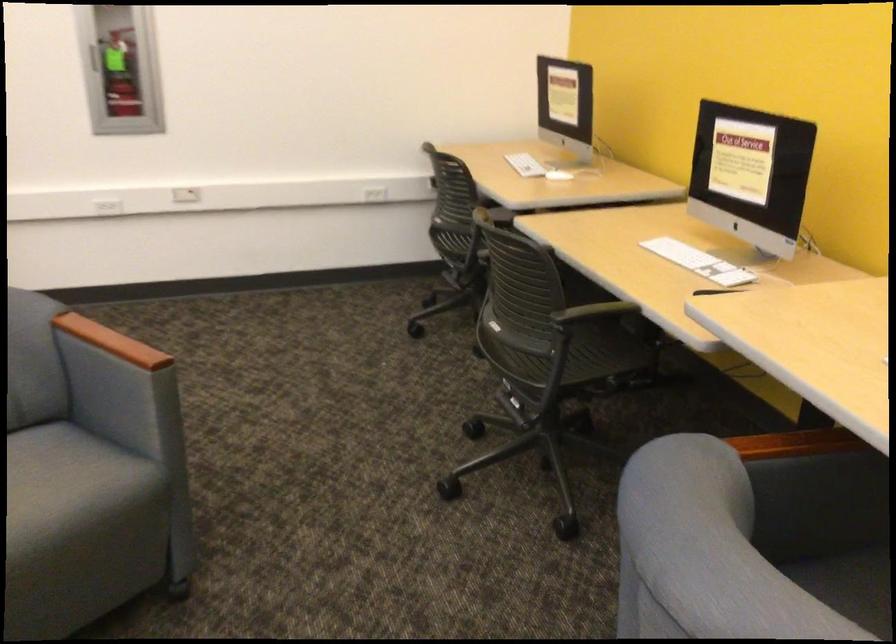
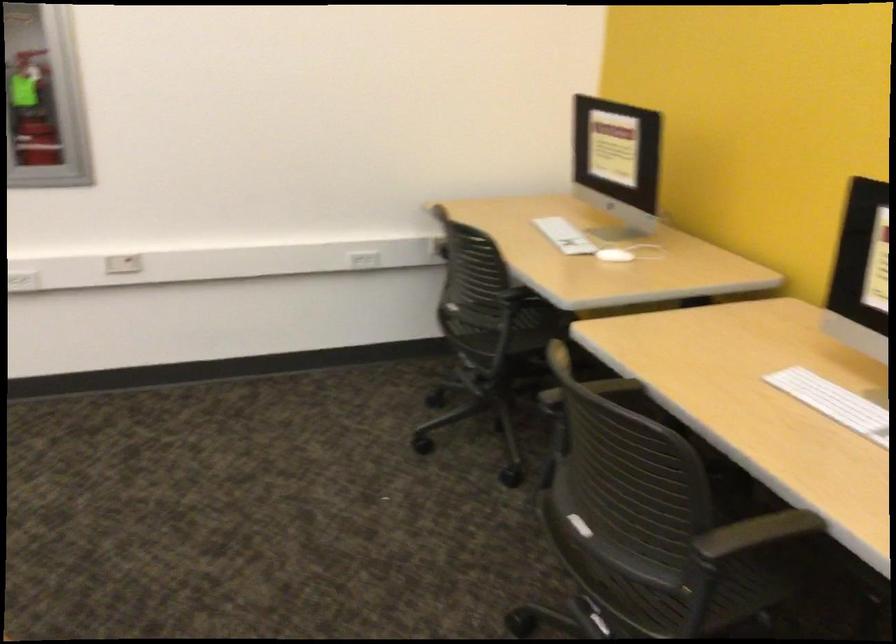
Question: Based on the continuous images, in which direction is the camera rotating? Reply with the corresponding letter.

Choices:
 (A) Left
 (B) Right
 (C) Up
 (D) Down

Answer: (B)